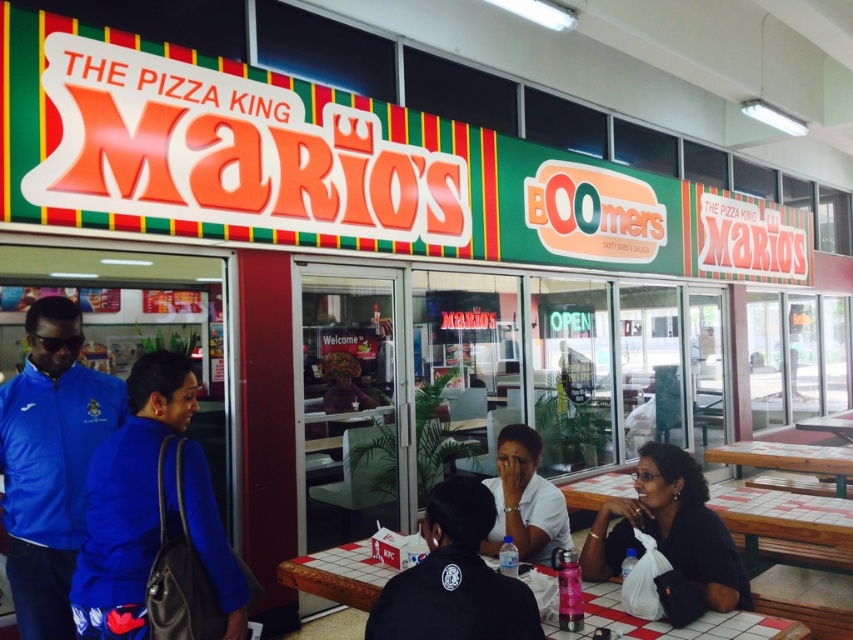
You are standing at the entrance of the restaurant and want to take a photo of the point located at coordinates point (49,336). If your camera has a maximum zoom range of 10 feet, will you be able to capture the point in your photo?

The point (49,336) is 8.05 feet away from the camera, which is within the camera maximum zoom range of 10 feet. Therefore, the camera can capture the point in the photo.

You are standing outside the Marios restaurant and notice a blue fabric jacket at center and a wooden bench at lower right. Which object is nearer to you?

The blue fabric jacket at center is closer to the viewer than the wooden bench at lower right.